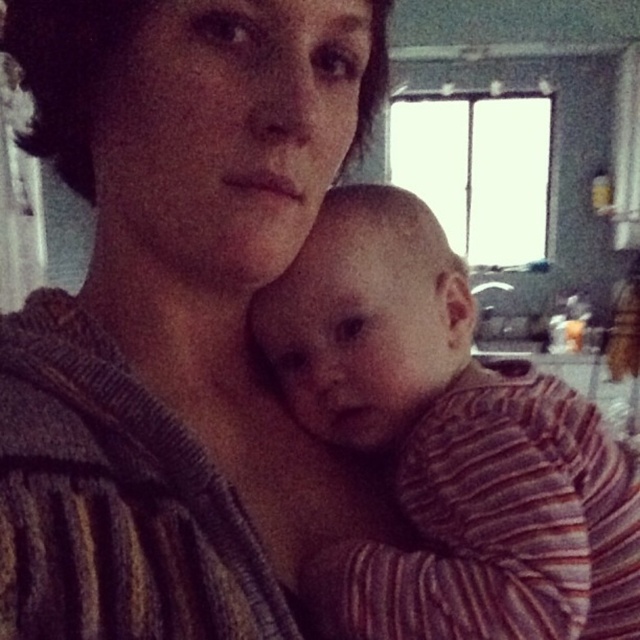
You are a photographer adjusting the lighting in a studio. You have two subjects in the frame, the striped sweater at center and the striped fabric baby at center. Which subject should you focus on first if you want to highlight the taller object?

The striped sweater at center is taller than the striped fabric baby at center, so you should focus on the striped sweater at center first to highlight the taller object.

You are a photographer trying to focus on the striped sweater at center and the striped fabric baby at center in the image. Which object should you adjust your camera focus on first to ensure both are in focus?

You should focus on the striped sweater at center first since it is closer to the viewer than the striped fabric baby at center, allowing the camera to adjust depth of field to include both.